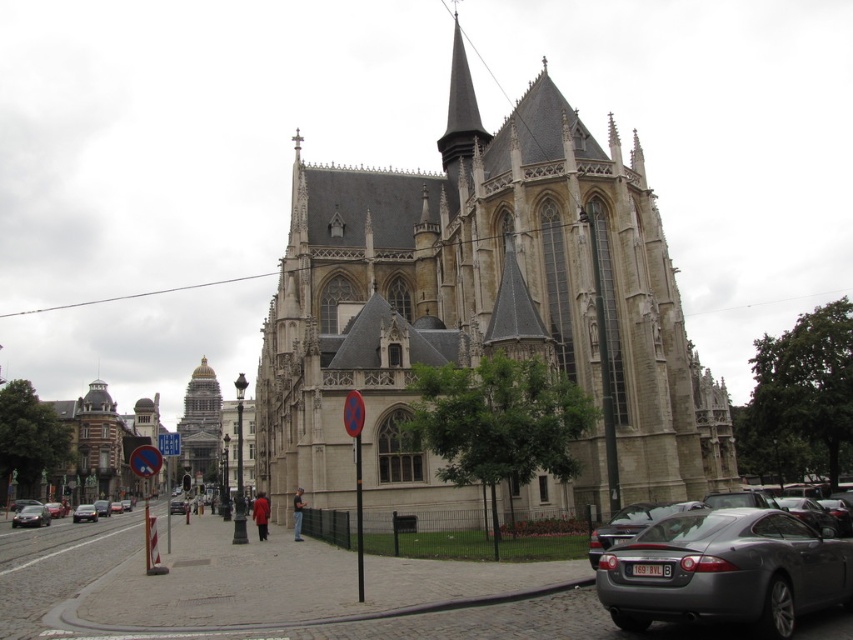
Looking at this image, you are standing in the urban area and want to take a photo of the stone gothic church at center and the metallic silver car at lower right. Which object should you focus on first if you want to capture both in a single frame without moving the camera?

The stone gothic church at center is taller than the metallic silver car at lower right, so you should focus on the stone gothic church at center first to ensure it fits within the frame.

You are standing at the base of the cathedral and notice a point marked at coordinates (201, 426). Based on the cathedral layout, what significant architectural feature does this point likely indicate?

The point marked at coordinates (201, 426) indicates the location of the gold polished tower at center.